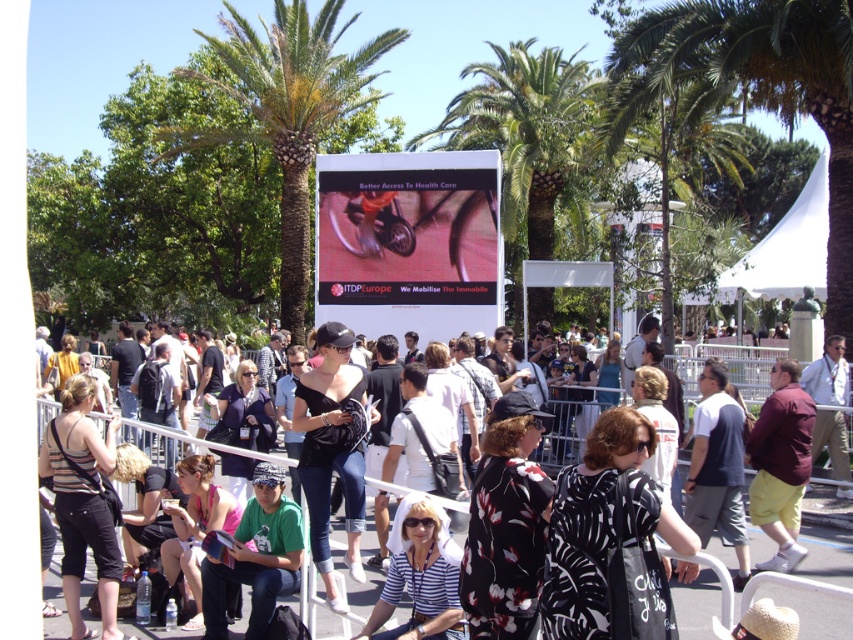
Question: Which of the following is the farthest from the observer?

Choices:
 (A) maroon fabric shirt at right
 (B) striped fabric hat at center
 (C) black fabric dress at center
 (D) green leafy palm tree at upper right

Answer: (D)

Question: In this image, where is striped fabric tank top at center located relative to striped fabric hat at center?

Choices:
 (A) left
 (B) right

Answer: (A)

Question: Does green fabric shirt at lower left have a lesser width compared to white cotton t-shirt at center?

Choices:
 (A) yes
 (B) no

Answer: (B)

Question: Which point is farther from the camera taking this photo?

Choices:
 (A) (759, 456)
 (B) (432, 548)
 (C) (540, 120)
 (D) (357, 568)

Answer: (C)

Question: Which of the following is the farthest from the observer?

Choices:
 (A) green leafy palm tree at upper right
 (B) white cotton t-shirt at center

Answer: (A)

Question: Does black floral dress at center appear on the right side of white cotton t-shirt at center?

Choices:
 (A) no
 (B) yes

Answer: (A)